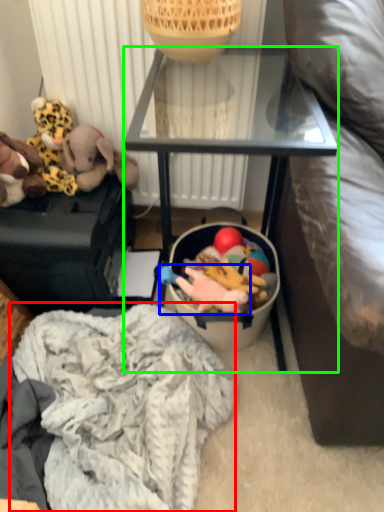
Question: Considering the real-world distances, which object is farthest from clothing (highlighted by a red box)? toy (highlighted by a blue box) or furniture (highlighted by a green box)?

Choices:
 (A) toy
 (B) furniture

Answer: (B)